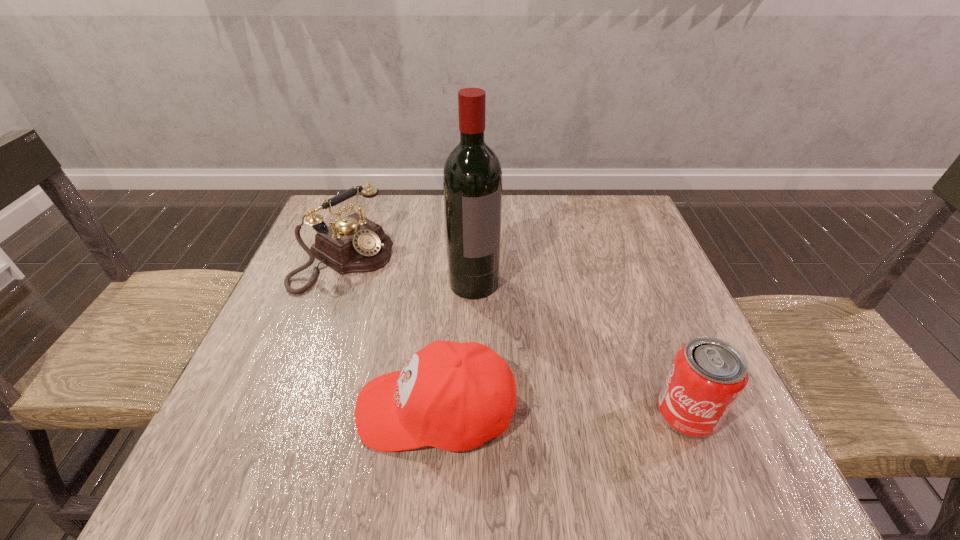
In order to click on object that is at the near right corner in this screenshot , I will do `click(707, 376)`.

Image resolution: width=960 pixels, height=540 pixels. I want to click on vacant area at the far edge of the desktop, so click(422, 228).

At what (x,y) coordinates should I click in order to perform the action: click on free region at the near edge of the desktop. Please return your answer as a coordinate pair (x, y). This screenshot has width=960, height=540. Looking at the image, I should click on tap(318, 417).

Identify the location of free space at the left edge of the desktop. The width and height of the screenshot is (960, 540). (296, 278).

Image resolution: width=960 pixels, height=540 pixels. I want to click on vacant space at the right edge of the desktop, so click(x=624, y=346).

The height and width of the screenshot is (540, 960). I want to click on free space at the far left corner of the desktop, so click(x=334, y=211).

Image resolution: width=960 pixels, height=540 pixels. In the image, there is a desktop. In order to click on vacant space at the near left corner in this screenshot , I will do `click(266, 393)`.

Where is `vacant space at the far right corner of the desktop`? This screenshot has width=960, height=540. vacant space at the far right corner of the desktop is located at coordinates (619, 239).

At what (x,y) coordinates should I click in order to perform the action: click on vacant area that lies between the baseball cap and the telephone. Please return your answer as a coordinate pair (x, y). The image size is (960, 540). Looking at the image, I should click on (390, 333).

You are a GUI agent. You are given a task and a screenshot of the screen. Output one action in this format:
    pyautogui.click(x=<x>, y=<y>)
    Task: Click on the vacant space that is in between the wine bottle and the can
    The height and width of the screenshot is (540, 960).
    Given the screenshot: What is the action you would take?
    pyautogui.click(x=581, y=348)